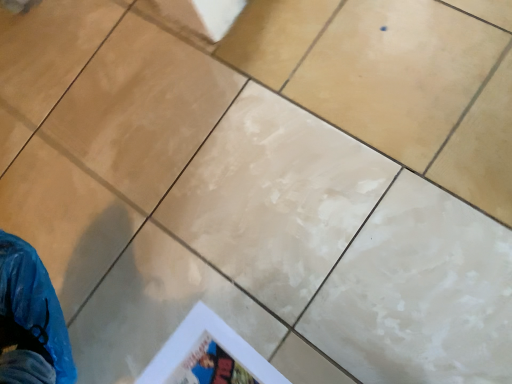
Question: Which is correct: white paper poster at lower center is inside matte beige tile at center, or outside of it?

Choices:
 (A) outside
 (B) inside

Answer: (A)

Question: Considering the positions of white paper poster at lower center and matte beige tile at center in the image, is white paper poster at lower center bigger or smaller than matte beige tile at center?

Choices:
 (A) small
 (B) big

Answer: (A)

Question: Is white paper poster at lower center taller or shorter than matte beige tile at center?

Choices:
 (A) short
 (B) tall

Answer: (B)

Question: Is matte beige tile at center to the left or to the right of white paper poster at lower center in the image?

Choices:
 (A) right
 (B) left

Answer: (A)

Question: Is matte beige tile at center situated inside white paper poster at lower center or outside?

Choices:
 (A) inside
 (B) outside

Answer: (B)

Question: Is matte beige tile at center in front of or behind white paper poster at lower center in the image?

Choices:
 (A) front
 (B) behind

Answer: (B)

Question: From the image's perspective, relative to white paper poster at lower center, is matte beige tile at center above or below?

Choices:
 (A) above
 (B) below

Answer: (A)